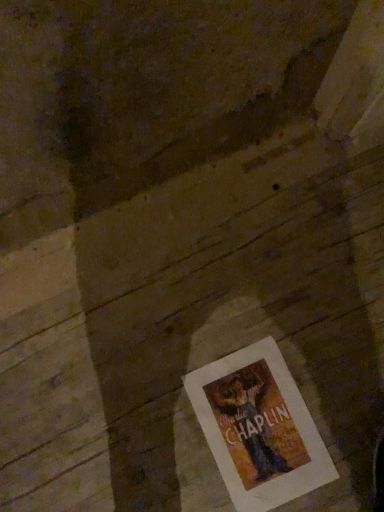
I want to click on free space to the right of matte paper poster at lower center, so click(343, 395).